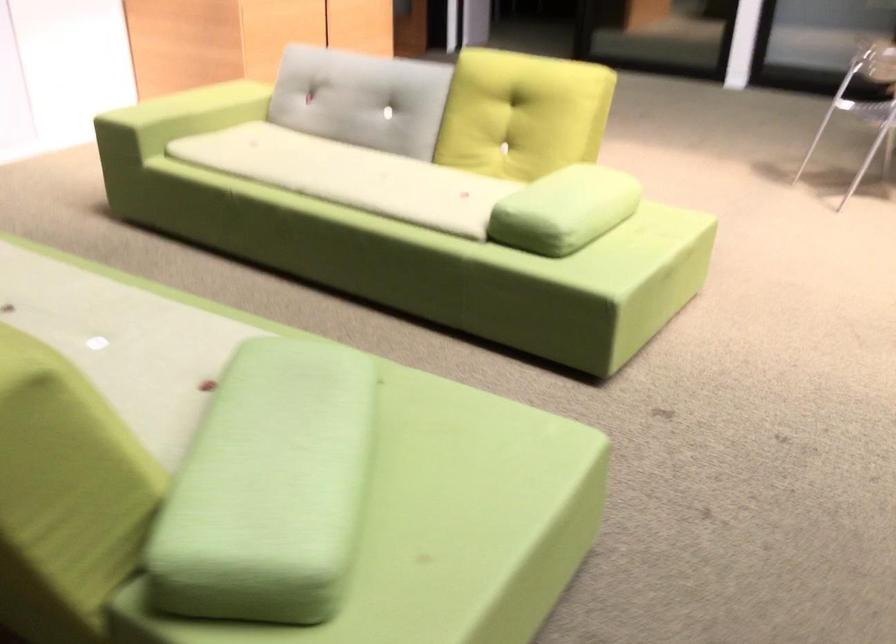
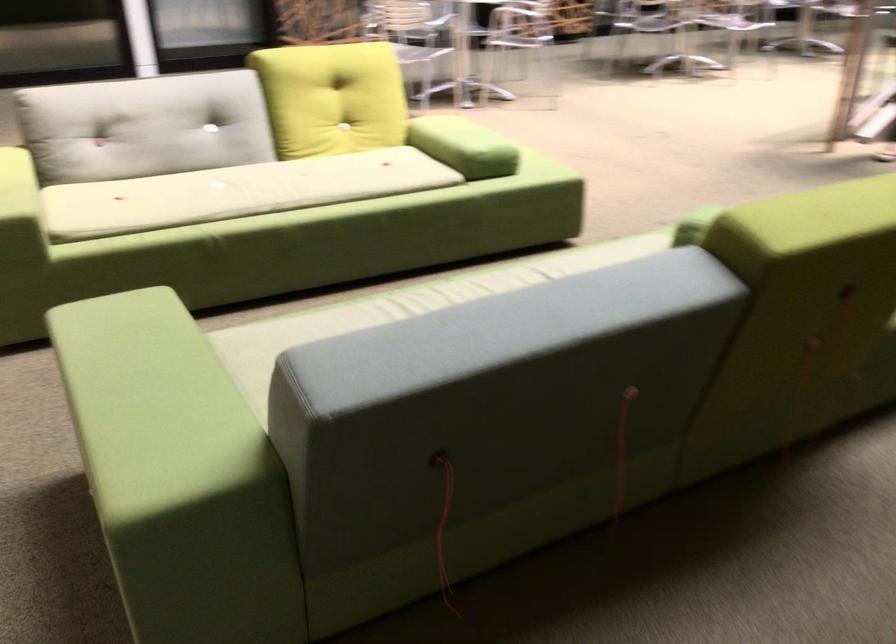
The point at (502,202) is marked in the first image. Where is the corresponding point in the second image?

(464, 146)